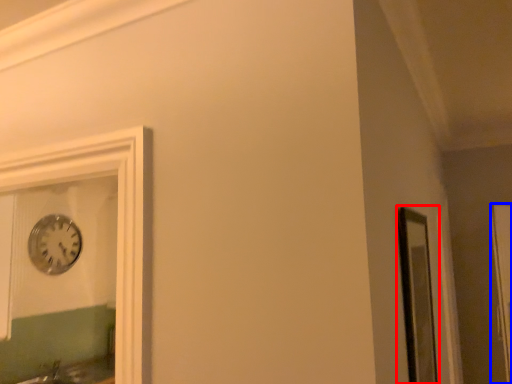
Question: Which of the following is the farthest to the observer, window frame (highlighted by a red box) or glass door (highlighted by a blue box)?

Choices:
 (A) window frame
 (B) glass door

Answer: (B)